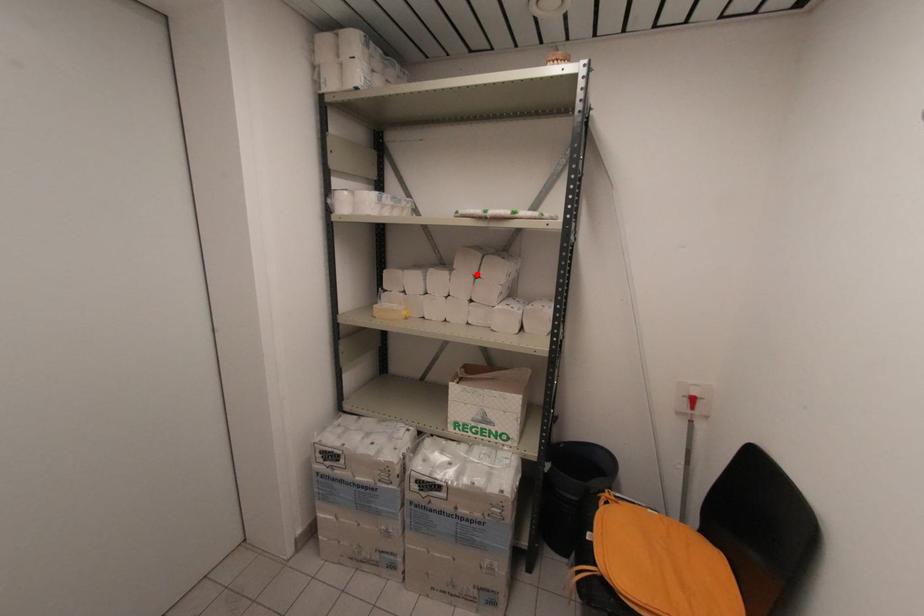
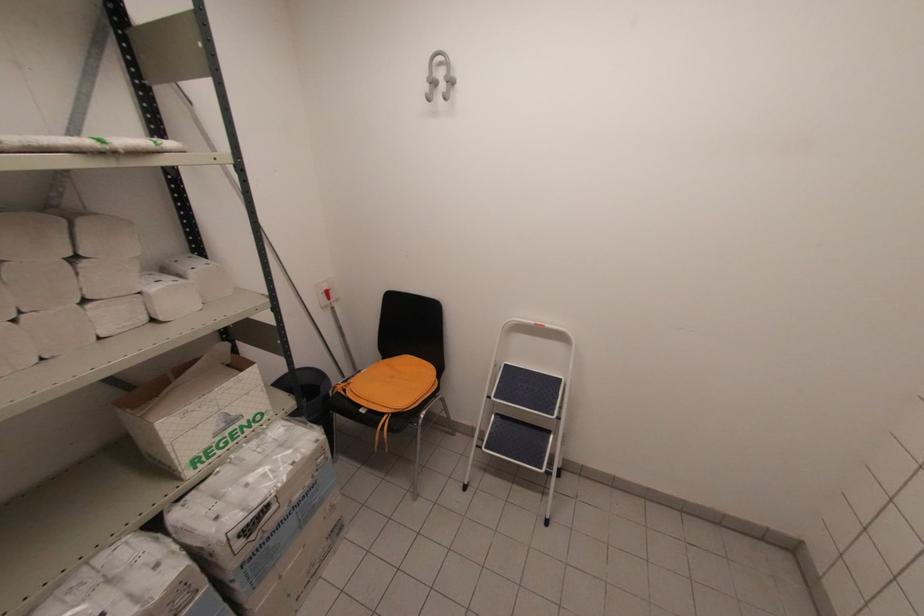
Where in the second image is the point corresponding to the highlighted location from the first image?

(71, 254)